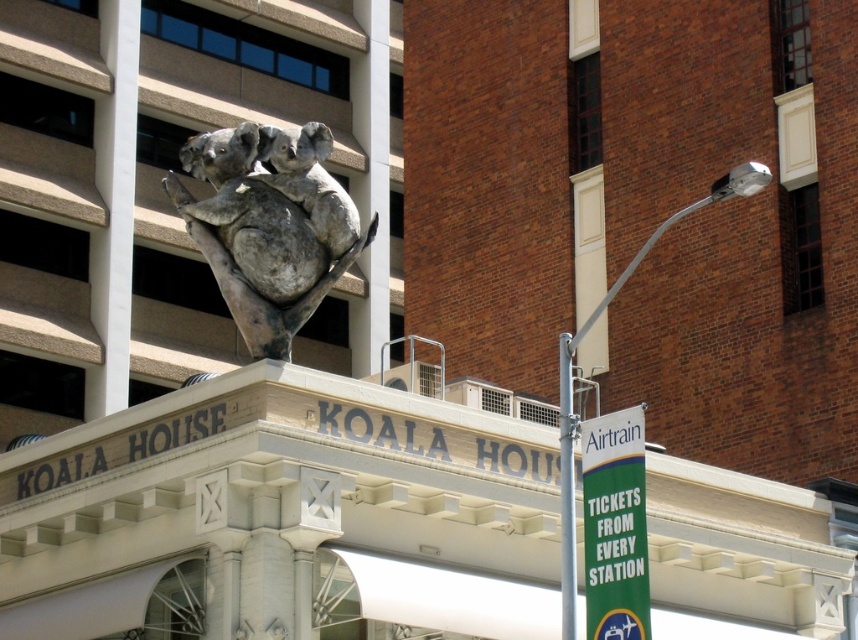
Locate an element on the screen. Image resolution: width=858 pixels, height=640 pixels. gray stone koala at center is located at coordinates (269, 225).

Between gray stone koala at center and white smooth pillar at upper left, which one appears on the right side from the viewer's perspective?

gray stone koala at center is more to the right.

Does point (273, 150) come in front of point (112, 122)?

Yes.

The width and height of the screenshot is (858, 640). I want to click on gray stone koala at center, so point(269,225).

Measure the distance between gray stone koala at center and green fabric banner at right.

A distance of 10.96 meters exists between gray stone koala at center and green fabric banner at right.

In the scene shown: Is gray stone koala at center below green fabric banner at right?

Incorrect, gray stone koala at center is not positioned below green fabric banner at right.

At what (x,y) coordinates should I click in order to perform the action: click on gray stone koala at center. Please return your answer as a coordinate pair (x, y). The width and height of the screenshot is (858, 640). Looking at the image, I should click on 269,225.

Locate an element on the screen. The width and height of the screenshot is (858, 640). gray stone koala at center is located at coordinates (269, 225).

Can you confirm if green fabric banner at right is bigger than metallic silver lamp post at upper right?

Actually, green fabric banner at right might be smaller than metallic silver lamp post at upper right.

Does green fabric banner at right have a lesser height compared to metallic silver lamp post at upper right?

Yes, green fabric banner at right is shorter than metallic silver lamp post at upper right.

Does point (623, 589) come farther from viewer compared to point (566, 593)?

No.

Locate an element on the screen. green fabric banner at right is located at coordinates (615, 525).